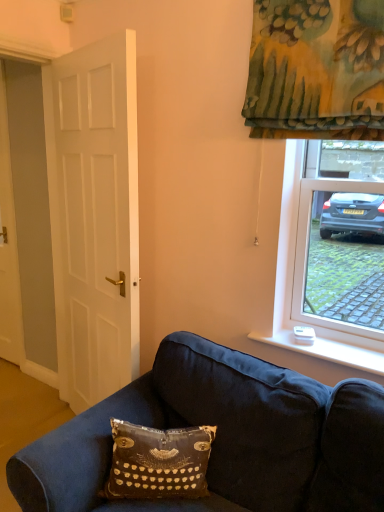
Question: From the image's perspective, is white wood door at left, the 1th door viewed from the back, beneath white matte door at left, the 2th door positioned from the left?

Choices:
 (A) no
 (B) yes

Answer: (A)

Question: From a real-world perspective, is white wood door at left, the second door when ordered from front to back, beneath white matte door at left, which appears as the 2th door when viewed from the back?

Choices:
 (A) yes
 (B) no

Answer: (A)

Question: From the image's perspective, is white wood door at left, the first door when ordered from left to right, above white matte door at left, the 2th door positioned from the left?

Choices:
 (A) yes
 (B) no

Answer: (A)

Question: Is white wood door at left, the second door when ordered from front to back, oriented away from white matte door at left, positioned as the first door in right-to-left order?

Choices:
 (A) yes
 (B) no

Answer: (B)

Question: Considering the relative positions of white wood door at left, the second door when ordered from front to back, and white matte door at left, which appears as the 2th door when viewed from the back, in the image provided, is white wood door at left, the second door when ordered from front to back, in front of white matte door at left, which appears as the 2th door when viewed from the back,?

Choices:
 (A) no
 (B) yes

Answer: (A)

Question: Is white plastic remote control at lower right situated inside velvety black pillow with typewriter design at lower center or outside?

Choices:
 (A) outside
 (B) inside

Answer: (A)

Question: Considering the positions of white plastic remote control at lower right and velvety black pillow with typewriter design at lower center in the image, is white plastic remote control at lower right wider or thinner than velvety black pillow with typewriter design at lower center?

Choices:
 (A) wide
 (B) thin

Answer: (B)

Question: Based on their positions, is white plastic remote control at lower right located to the left or right of velvety black pillow with typewriter design at lower center?

Choices:
 (A) right
 (B) left

Answer: (A)

Question: From a real-world perspective, is white plastic remote control at lower right positioned above or below velvety black pillow with typewriter design at lower center?

Choices:
 (A) below
 (B) above

Answer: (B)

Question: Considering the positions of velvety black pillow with typewriter design at lower center and white plastic remote control at lower right in the image, is velvety black pillow with typewriter design at lower center wider or thinner than white plastic remote control at lower right?

Choices:
 (A) thin
 (B) wide

Answer: (B)

Question: Relative to white plastic remote control at lower right, is velvety black pillow with typewriter design at lower center in front or behind?

Choices:
 (A) front
 (B) behind

Answer: (A)

Question: Based on their sizes in the image, would you say velvety black pillow with typewriter design at lower center is bigger or smaller than white plastic remote control at lower right?

Choices:
 (A) small
 (B) big

Answer: (B)

Question: In the image, is velvety black pillow with typewriter design at lower center on the left side or the right side of white plastic remote control at lower right?

Choices:
 (A) right
 (B) left

Answer: (B)

Question: Considering the positions of white matte door at left, the 2th door positioned from the left, and velvety black pillow with typewriter design at lower center in the image, is white matte door at left, the 2th door positioned from the left, wider or thinner than velvety black pillow with typewriter design at lower center?

Choices:
 (A) wide
 (B) thin

Answer: (B)

Question: From the image's perspective, is white matte door at left, the 1th door positioned from the front, located above or below velvety black pillow with typewriter design at lower center?

Choices:
 (A) above
 (B) below

Answer: (A)